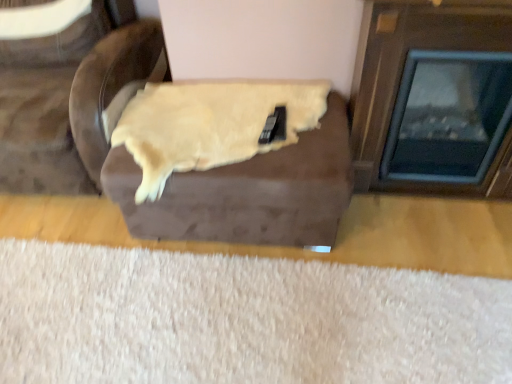
Question: From the image's perspective, relative to brown suede armchair at upper left, acting as the first furniture starting from the left, is white fluffy rug at lower center above or below?

Choices:
 (A) below
 (B) above

Answer: (A)

Question: Is white fluffy rug at lower center to the left or to the right of brown suede armchair at upper left, the 2th furniture viewed from the right, in the image?

Choices:
 (A) left
 (B) right

Answer: (B)

Question: Which of these objects is positioned closest to the brown suede ottoman at center, the second furniture in the left-to-right sequence?

Choices:
 (A) white fluffy rug at lower center
 (B) brown suede armchair at upper left, the 2th furniture viewed from the right
 (C) wooden fireplace at right

Answer: (B)

Question: Which is nearer to the wooden fireplace at right?

Choices:
 (A) brown suede ottoman at center, the second furniture in the left-to-right sequence
 (B) white fluffy rug at lower center
 (C) brown suede armchair at upper left, the 2th furniture viewed from the right

Answer: (A)